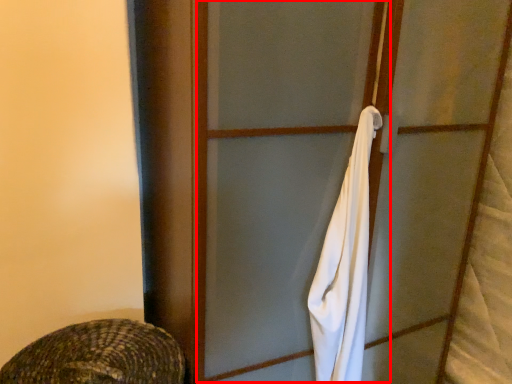
Question: Considering the relative positions of screen door (annotated by the red box) and towel/napkin in the image provided, where is screen door (annotated by the red box) located with respect to the staircase?

Choices:
 (A) left
 (B) right

Answer: (A)